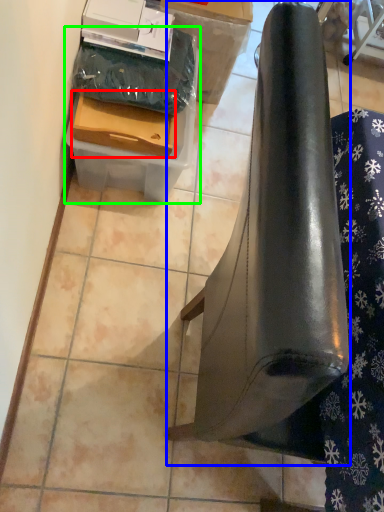
Question: Based on their relative distances, which object is farther from drawer (highlighted by a red box)? Choose from furniture (highlighted by a blue box) and cardboard box (highlighted by a green box).

Choices:
 (A) furniture
 (B) cardboard box

Answer: (A)